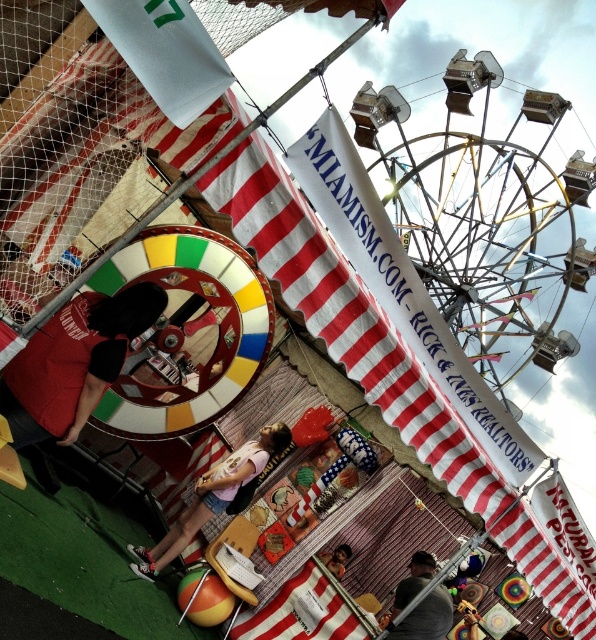
Question: Is the position of pink fabric at center less distant than that of dark gray shirt at lower center?

Choices:
 (A) yes
 (B) no

Answer: (A)

Question: Which object appears closest to the camera in this image?

Choices:
 (A) pink fabric at center
 (B) metallic ferris wheel at upper center

Answer: (A)

Question: Which point appears farthest from the camera in this image?

Choices:
 (A) (141, 570)
 (B) (20, 412)
 (C) (343, 570)
 (D) (395, 220)

Answer: (D)

Question: Does pink fabric at center have a lesser width compared to smooth skin face at lower center?

Choices:
 (A) yes
 (B) no

Answer: (B)

Question: Does matte red shirt at left appear under pink fabric at center?

Choices:
 (A) yes
 (B) no

Answer: (B)

Question: Which of the following is the farthest from the observer?

Choices:
 (A) metallic ferris wheel at upper center
 (B) pink fabric at center
 (C) matte red shirt at left
 (D) dark gray shirt at lower center

Answer: (A)